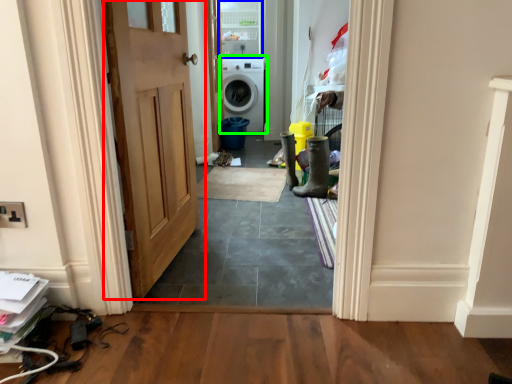
Question: Which is nearer to the door (highlighted by a red box)? glass door (highlighted by a blue box) or washing machine (highlighted by a green box).

Choices:
 (A) glass door
 (B) washing machine

Answer: (B)